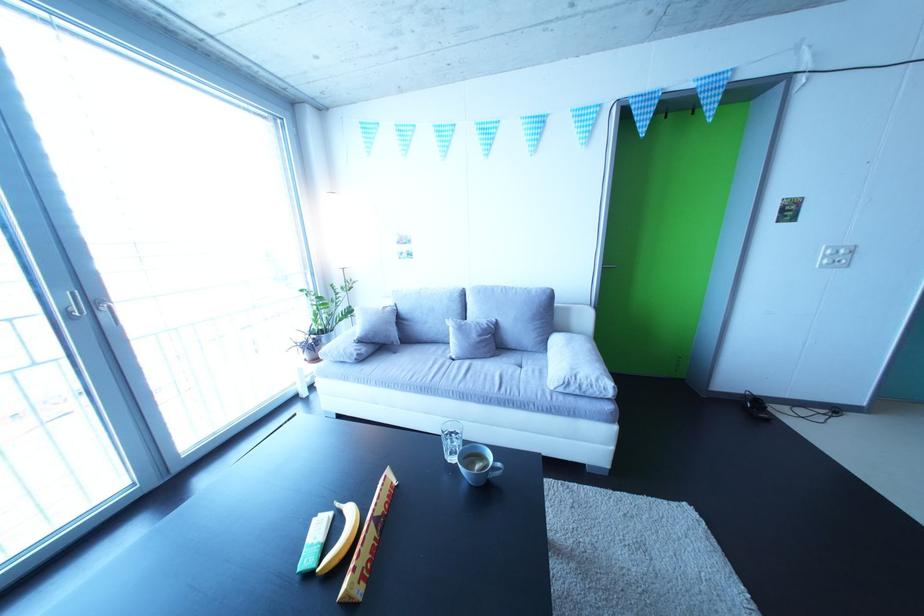
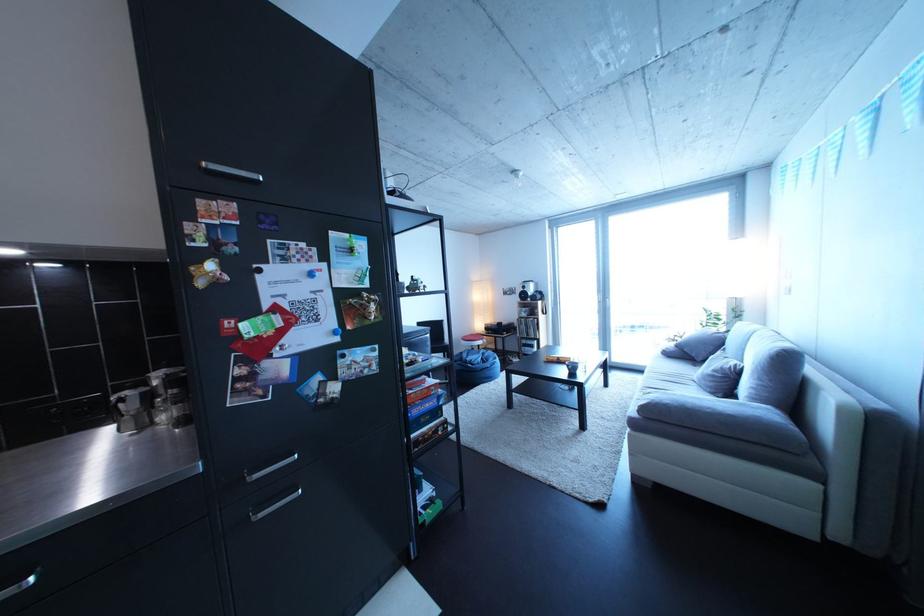
Find the pixel in the second image that matches (x=374, y=365) in the first image.

(682, 361)